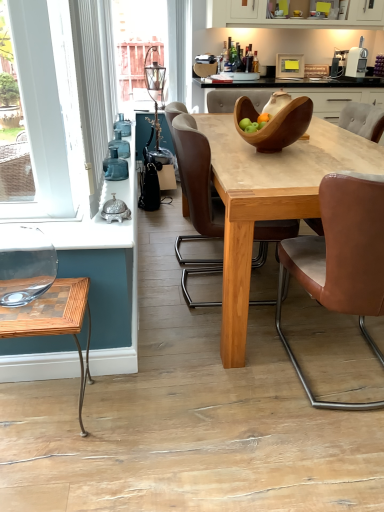
In order to face wooden checkered coffee table at lower left, should I rotate leftwards or rightwards?

Turn left by 20.093 degrees to look at wooden checkered coffee table at lower left.

Describe the element at coordinates (294, 94) in the screenshot. I see `wooden bowl at center` at that location.

Locate an element on the screen. The height and width of the screenshot is (512, 384). white matte cabinet at upper center is located at coordinates (293, 17).

Can you confirm if wooden bowl at center is thinner than brown leather chair at center, arranged as the 2th chair when viewed from the right?

In fact, wooden bowl at center might be wider than brown leather chair at center, arranged as the 2th chair when viewed from the right.

From the image's perspective, count 3rd chairs downward from the wooden bowl at center and point to it. Please provide its 2D coordinates.

[(341, 260)]

Is wooden bowl at center inside the boundaries of brown leather chair at center, arranged as the 2th chair when viewed from the right, or outside?

wooden bowl at center is located beyond the bounds of brown leather chair at center, arranged as the 2th chair when viewed from the right.

Considering the sizes of objects natural wood table at center and white matte cabinet at upper center in the image provided, who is wider, natural wood table at center or white matte cabinet at upper center?

With larger width is natural wood table at center.

Can you confirm if natural wood table at center is positioned to the left of white matte cabinet at upper center?

Correct, you'll find natural wood table at center to the left of white matte cabinet at upper center.

Is the position of natural wood table at center less distant than that of white matte cabinet at upper center?

That is True.

Is wooden checkered coffee table at lower left bigger than wooden bowl at center?

Yes.

Based on the photo, does wooden checkered coffee table at lower left have a lesser height compared to wooden bowl at center?

No, wooden checkered coffee table at lower left is not shorter than wooden bowl at center.

From a real-world perspective, which is physically below, wooden checkered coffee table at lower left or wooden bowl at center?

wooden checkered coffee table at lower left is physically lower.

Is there a large distance between wooden checkered coffee table at lower left and wooden bowl at center?

That's right, there is a large distance between wooden checkered coffee table at lower left and wooden bowl at center.

Considering the relative sizes of white plastic toaster at upper right and wooden bowl at center in the image provided, is white plastic toaster at upper right wider than wooden bowl at center?

No.

There is a wooden bowl at center. Identify the location of appliance above it (from a real-world perspective). (289, 66).

From the image's perspective, is white plastic toaster at upper right located beneath wooden bowl at center?

No.

Is brown leather chair at center, placed as the 1th chair when sorted from left to right, taller than white textured curtain at left?

No, brown leather chair at center, placed as the 1th chair when sorted from left to right, is not taller than white textured curtain at left.

Is brown leather chair at center, which ranks as the 3th chair in right-to-left order, behind white textured curtain at left?

Yes, brown leather chair at center, which ranks as the 3th chair in right-to-left order, is behind white textured curtain at left.

Where is `the 2nd chair behind the white textured curtain at left, starting your count from the anchor`? the 2nd chair behind the white textured curtain at left, starting your count from the anchor is located at coordinates (196, 199).

Is brown leather chair at center, which ranks as the 3th chair in right-to-left order, turned away from white textured curtain at left?

That's not correct — brown leather chair at center, which ranks as the 3th chair in right-to-left order, is not looking away from white textured curtain at left.

Could you tell me if white matte cabinet at upper center is facing natural wood table at center?

No, white matte cabinet at upper center is not turned towards natural wood table at center.

Is point (233, 17) positioned after point (236, 234)?

Yes, point (233, 17) is behind point (236, 234).

Based on the photo, which of these two, white matte cabinet at upper center or natural wood table at center, is wider?

natural wood table at center.

Which object is positioned more to the right, white matte cabinet at upper center or natural wood table at center?

Positioned to the right is white matte cabinet at upper center.

Do you think brown leather chair at center, which ranks as the 3th chair in right-to-left order, is within brown leather chair at right, acting as the first chair starting from the right, or outside of it?

brown leather chair at center, which ranks as the 3th chair in right-to-left order, is not inside brown leather chair at right, acting as the first chair starting from the right, it's outside.

Is point (178, 249) closer to viewer compared to point (307, 224)?

No, (178, 249) is further to viewer.

Does brown leather chair at center, placed as the 1th chair when sorted from left to right, have a larger size compared to brown leather chair at right, placed as the 3th chair when sorted from left to right?

Correct, brown leather chair at center, placed as the 1th chair when sorted from left to right, is larger in size than brown leather chair at right, placed as the 3th chair when sorted from left to right.

Are brown leather chair at center, placed as the 1th chair when sorted from left to right, and brown leather chair at right, placed as the 3th chair when sorted from left to right, far apart?

Yes.

You are a GUI agent. You are given a task and a screenshot of the screen. Output one action in this format:
    pyautogui.click(x=<x>, y=<y>)
    Task: Click on the counter behind the brown leather chair at center, which appears as the 2th chair when viewed from the left
    
    Given the screenshot: What is the action you would take?
    pyautogui.click(x=294, y=94)

At what (x,y) coordinates should I click in order to perform the action: click on cabinetry to the right of natural wood table at center. Please return your answer as a coordinate pair (x, y). Looking at the image, I should click on (293, 17).

Based on their spatial positions, is wooden checkered coffee table at lower left or brown leather chair at center, which ranks as the 3th chair in right-to-left order, closer to natural wood table at center?

brown leather chair at center, which ranks as the 3th chair in right-to-left order, lies closer to natural wood table at center than the other object.

Looking at the image, which one is located closer to wooden checkered coffee table at lower left, brown leather chair at center, arranged as the 2th chair when viewed from the right, or wooden bowl at center?

brown leather chair at center, arranged as the 2th chair when viewed from the right, is closer to wooden checkered coffee table at lower left.

When comparing their distances from wooden bowl at center, does brown leather chair at center, arranged as the 2th chair when viewed from the right, or white matte cabinet at upper center seem further?

white matte cabinet at upper center lies further to wooden bowl at center than the other object.

Estimate the real-world distances between objects in this image. Which object is closer to wooden bowl at center, brown leather chair at right, acting as the first chair starting from the right, or wooden bowl at center?

Based on the image, brown leather chair at right, acting as the first chair starting from the right, appears to be nearer to wooden bowl at center.

From the image, which object appears to be farther from white plastic toaster at upper right, natural wood table at center or brown leather chair at center, placed as the 1th chair when sorted from left to right?

brown leather chair at center, placed as the 1th chair when sorted from left to right, lies further to white plastic toaster at upper right than the other object.

From the image, which object appears to be nearer to white plastic toaster at upper right, wooden checkered coffee table at lower left or brown leather chair at right, acting as the first chair starting from the right?

brown leather chair at right, acting as the first chair starting from the right, is positioned closer to the anchor white plastic toaster at upper right.

When comparing their distances from wooden bowl at center, does wooden checkered coffee table at lower left or white matte cabinet at upper center seem closer?

The object closer to wooden bowl at center is wooden checkered coffee table at lower left.

Based on their spatial positions, is wooden checkered coffee table at lower left or white textured curtain at left closer to white matte cabinet at upper center?

The object closer to white matte cabinet at upper center is white textured curtain at left.

Identify the location of desk between white matte cabinet at upper center and brown leather chair at right, acting as the first chair starting from the right, vertically. The image size is (384, 512). click(x=268, y=198).

At what (x,y) coordinates should I click in order to perform the action: click on desk that lies between white matte cabinet at upper center and wooden checkered coffee table at lower left from top to bottom. Please return your answer as a coordinate pair (x, y). This screenshot has width=384, height=512. Looking at the image, I should click on (268, 198).

Identify the location of desk positioned between brown leather chair at center, which appears as the 2th chair when viewed from the left, and white matte cabinet at upper center from near to far. The image size is (384, 512). (268, 198).

The width and height of the screenshot is (384, 512). Find the location of `desk between brown leather chair at center, which appears as the 2th chair when viewed from the left, and brown leather chair at right, acting as the first chair starting from the right, along the z-axis`. desk between brown leather chair at center, which appears as the 2th chair when viewed from the left, and brown leather chair at right, acting as the first chair starting from the right, along the z-axis is located at coordinates (268, 198).